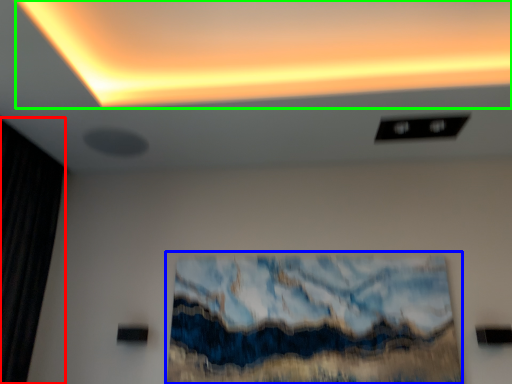
Question: Considering the real-world distances, which object is closest to curtain (highlighted by a red box)? oil painting (highlighted by a blue box) or glow (highlighted by a green box).

Choices:
 (A) oil painting
 (B) glow

Answer: (B)